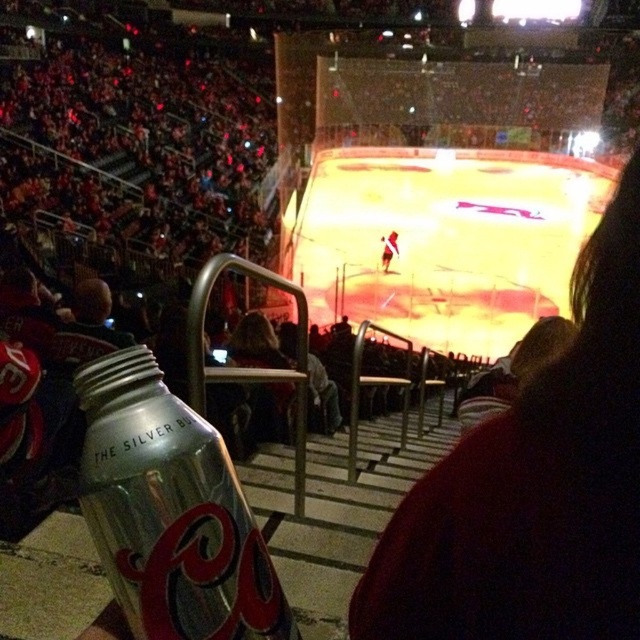
Question: Can you confirm if dark hair at center is positioned to the right of silver metallic can at lower left?

Choices:
 (A) yes
 (B) no

Answer: (A)

Question: In this image, where is dark hair at center located relative to silver metallic can at lower left?

Choices:
 (A) right
 (B) left

Answer: (A)

Question: Which point is farther from the camera taking this photo?

Choices:
 (A) 154,408
 (B) 589,346

Answer: (B)

Question: Does dark hair at center appear on the right side of silver metallic can at lower left?

Choices:
 (A) no
 (B) yes

Answer: (B)